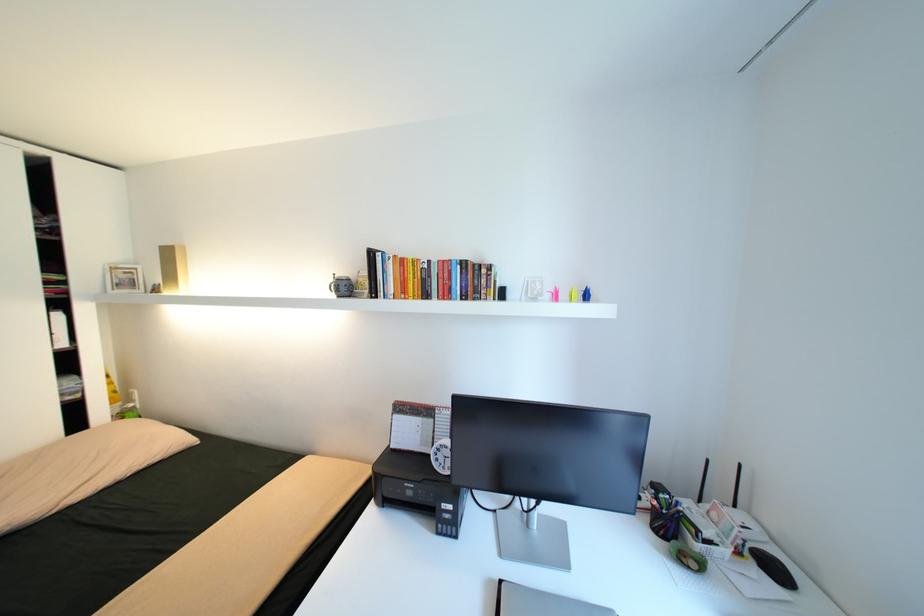
Find the location of `blue origami crane`. blue origami crane is located at coordinates (586, 294).